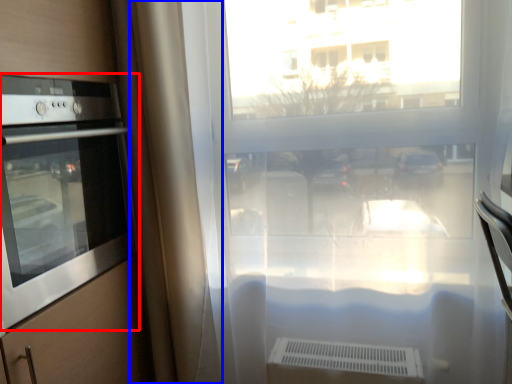
Question: Among these objects, which one is farthest to the camera, home appliance (highlighted by a red box) or curtain (highlighted by a blue box)?

Choices:
 (A) home appliance
 (B) curtain

Answer: (B)